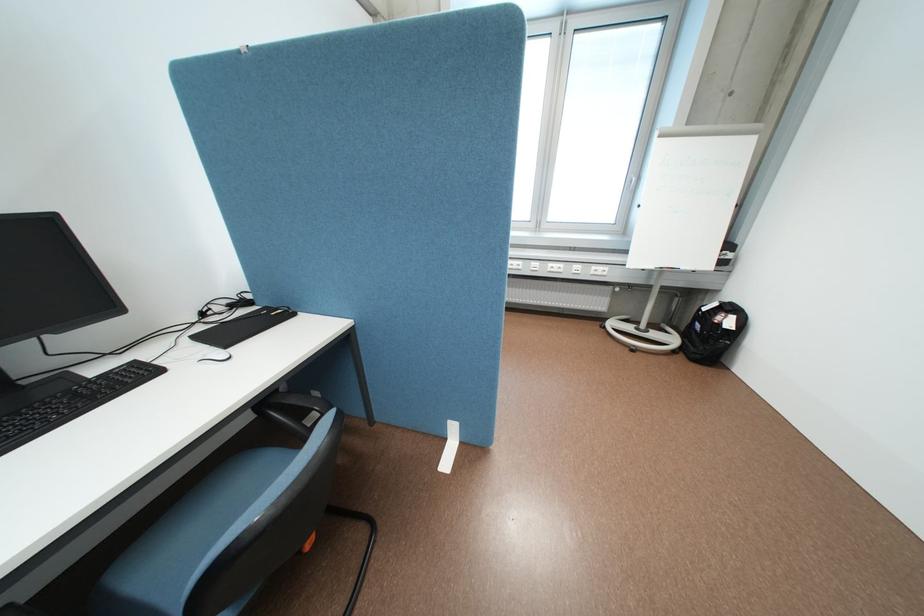
This screenshot has height=616, width=924. In order to click on blue chair sitting surface in this screenshot , I will do `click(200, 517)`.